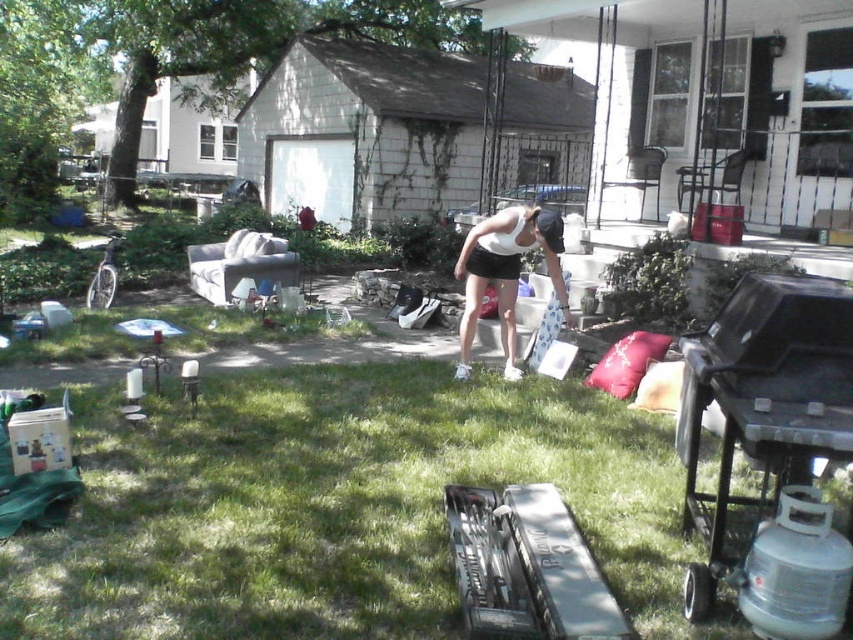
You are a delivery person trying to place a package between the black matte barbecue grill at lower right and the white matte tank top at center. The package requires 1.8 meters of space. Can you fit it there?

The black matte barbecue grill at lower right is 1.73 meters from the white matte tank top at center. Since the required space is 1.8 meters, the package cannot fit in that location.